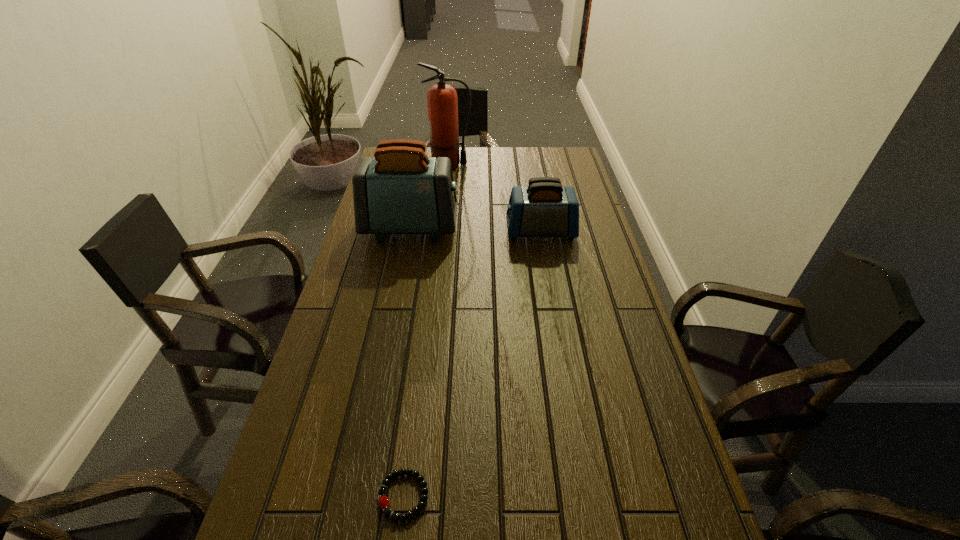
At what (x,y) coordinates should I click in order to perform the action: click on vacant space situated 0.370m on the front-facing side of the shorter toaster. Please return your answer as a coordinate pair (x, y). The height and width of the screenshot is (540, 960). Looking at the image, I should click on (396, 231).

The height and width of the screenshot is (540, 960). What are the coordinates of `vacant region located on the front-facing side of the shorter toaster` in the screenshot? It's located at (396, 231).

The width and height of the screenshot is (960, 540). I want to click on vacant space located on the front-facing side of the shorter toaster, so click(x=429, y=231).

Find the location of a particular element. This screenshot has height=540, width=960. free space located 0.220m on the back of the shortest object is located at coordinates (419, 379).

This screenshot has width=960, height=540. I want to click on object located at the far edge, so click(442, 101).

Locate an element on the screen. This screenshot has height=540, width=960. object located at the left edge is located at coordinates (401, 190).

Locate an element on the screen. The width and height of the screenshot is (960, 540). object located in the right edge section of the desktop is located at coordinates (544, 208).

Locate an element on the screen. vacant area at the far edge is located at coordinates (472, 150).

Where is `free space at the left edge of the desktop`? This screenshot has height=540, width=960. free space at the left edge of the desktop is located at coordinates (353, 256).

The width and height of the screenshot is (960, 540). I want to click on free space at the right edge, so click(x=586, y=229).